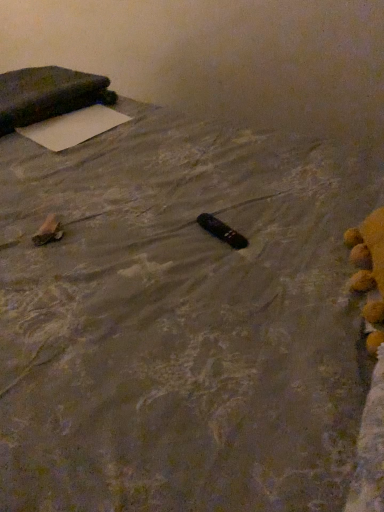
This screenshot has height=512, width=384. In order to click on free space above white matte yoga mat at upper left (from a real-world perspective) in this screenshot , I will do `click(77, 122)`.